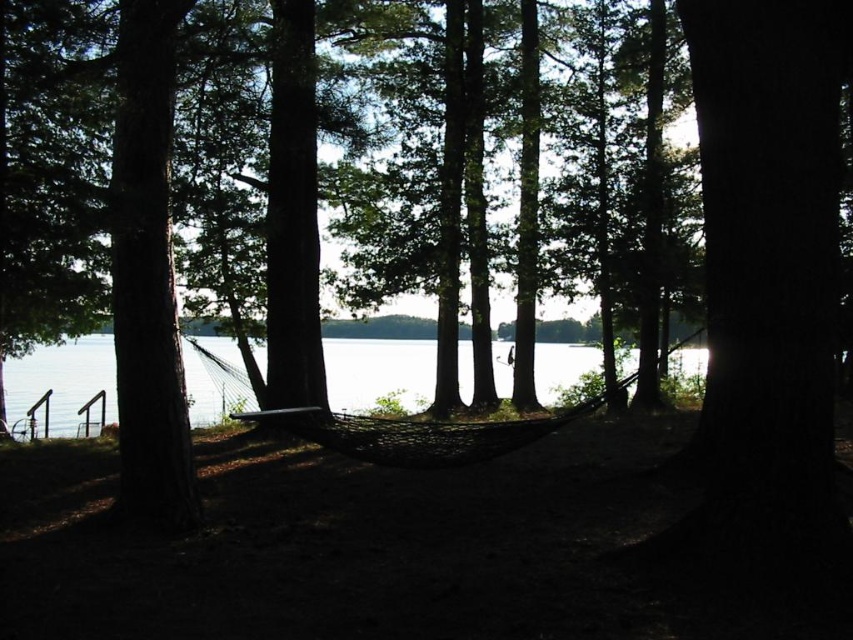
Question: Is clear water at center wider than black mesh hammock at center?

Choices:
 (A) no
 (B) yes

Answer: (B)

Question: Which of the following is the farthest from the observer?

Choices:
 (A) clear water at center
 (B) black mesh hammock at center

Answer: (A)

Question: Does clear water at center have a smaller size compared to black mesh hammock at center?

Choices:
 (A) yes
 (B) no

Answer: (B)

Question: Which object is farther from the camera taking this photo?

Choices:
 (A) clear water at center
 (B) black mesh hammock at center

Answer: (A)

Question: Can you confirm if clear water at center is wider than black mesh hammock at center?

Choices:
 (A) yes
 (B) no

Answer: (A)